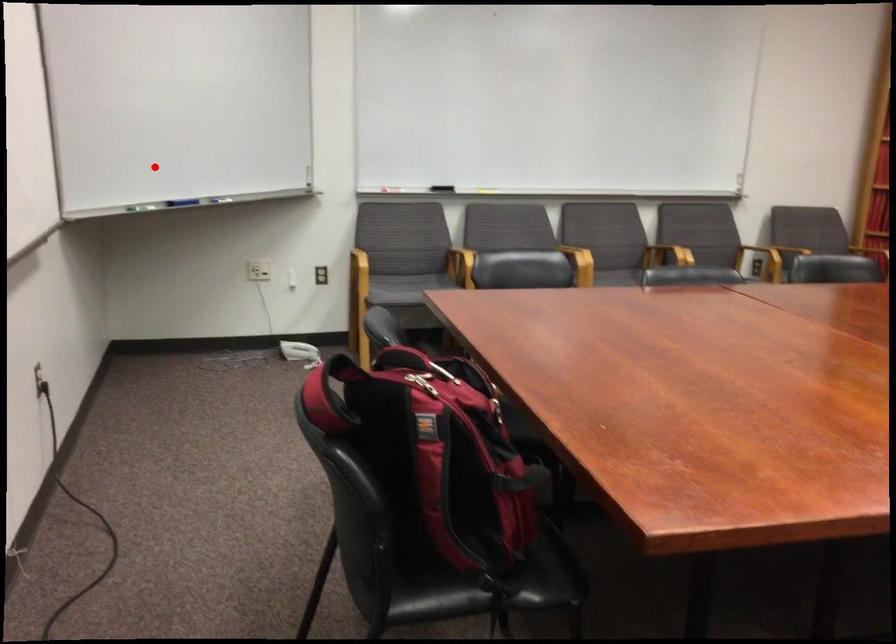
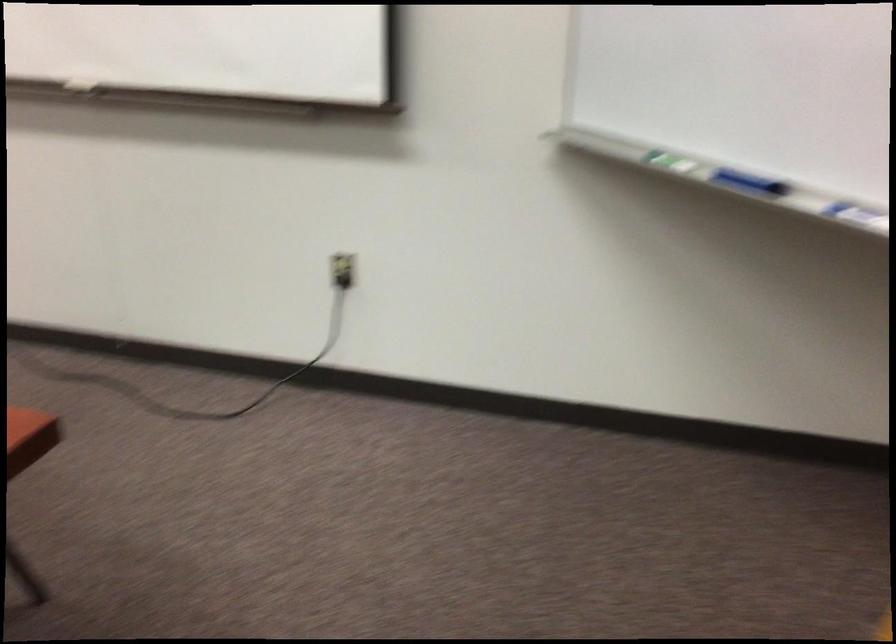
Question: I am providing you with two images of the same scene from different viewpoints. A red point is marked on the first image. Is the red point's position out of view in image 2?

Choices:
 (A) Yes
 (B) No

Answer: (B)